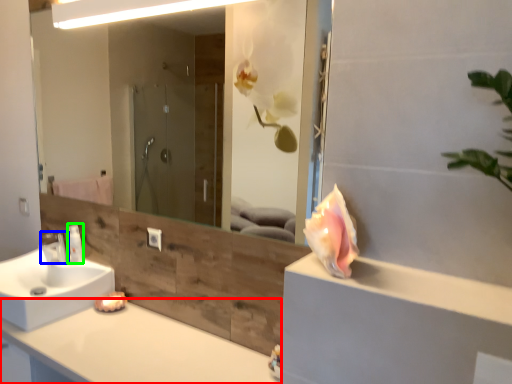
Question: Which object is the farthest from countertop (highlighted by a red box)? Choose among these: tap (highlighted by a blue box) or toiletry (highlighted by a green box).

Choices:
 (A) tap
 (B) toiletry

Answer: (A)